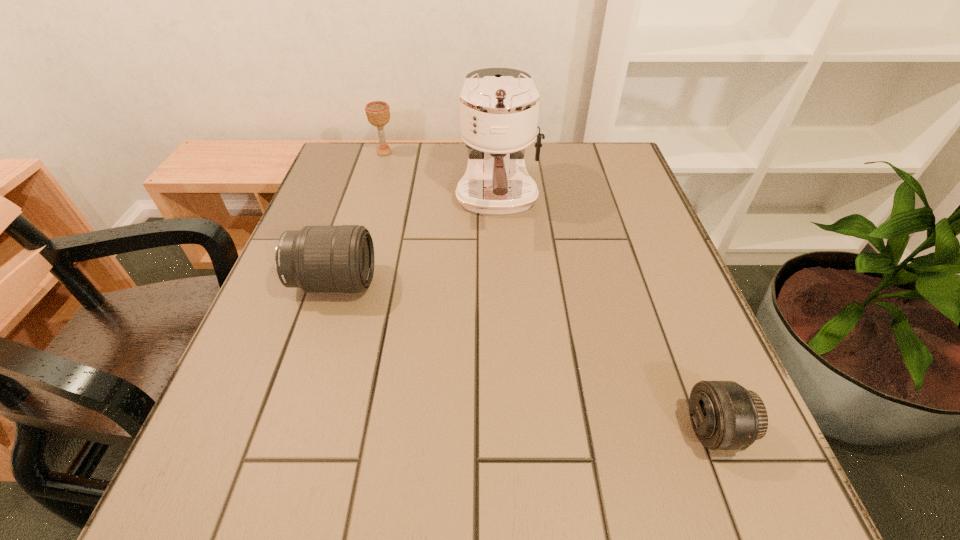
Locate an element on the screen. This screenshot has height=540, width=960. vacant region between the chalice and the taller telephoto lens is located at coordinates (359, 218).

The height and width of the screenshot is (540, 960). Identify the location of free space between the shorter telephoto lens and the farthest object. (549, 291).

Identify the location of unoccupied position between the shortest object and the tallest object. coord(606,315).

Identify which object is the nearest to the second farthest object. Please provide its 2D coordinates. Your answer should be formatted as a tuple, i.e. [(x, y)], where the tuple contains the x and y coordinates of a point satisfying the conditions above.

[(316, 258)]

Locate which object is the second closest to the third farthest object. Please provide its 2D coordinates. Your answer should be formatted as a tuple, i.e. [(x, y)], where the tuple contains the x and y coordinates of a point satisfying the conditions above.

[(378, 112)]

Where is `free space that satisfies the following two spatial constraints: 1. on the front-facing side of the third object from left to right; 2. on the surface of the taller telephoto lens`? free space that satisfies the following two spatial constraints: 1. on the front-facing side of the third object from left to right; 2. on the surface of the taller telephoto lens is located at coordinates (501, 283).

Identify the location of free space that satisfies the following two spatial constraints: 1. on the front side of the chalice; 2. on the surface of the third farthest object. (345, 283).